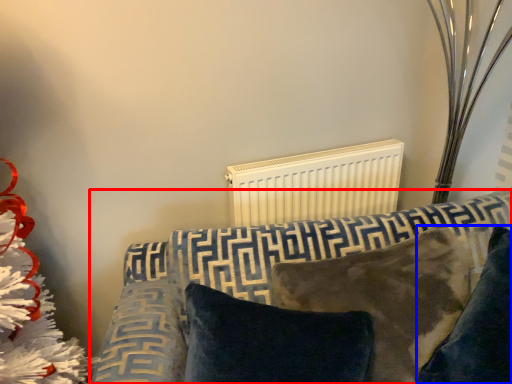
Question: Among these objects, which one is farthest to the camera, furniture (highlighted by a red box) or pillow (highlighted by a blue box)?

Choices:
 (A) furniture
 (B) pillow

Answer: (B)